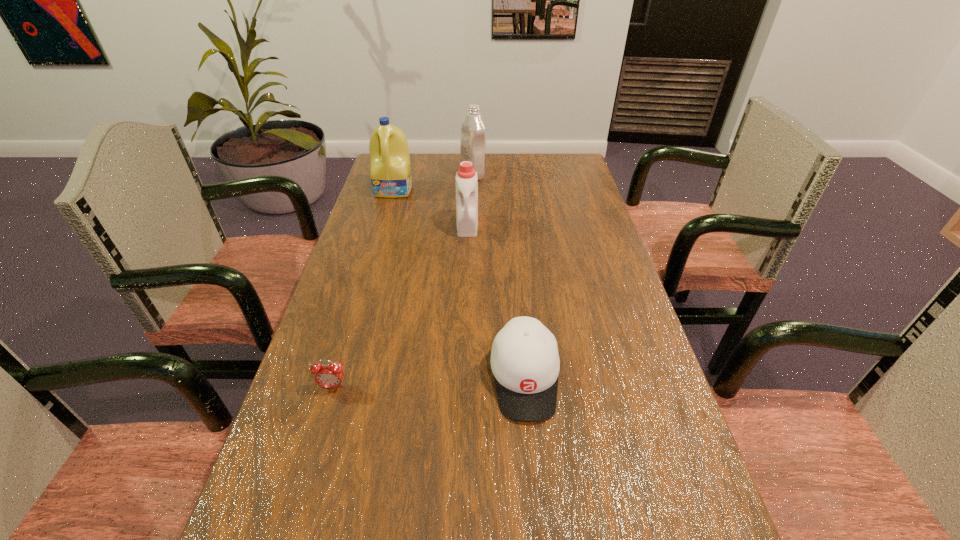
Where is `free space between the leftmost detergent and the third farthest object`? The width and height of the screenshot is (960, 540). free space between the leftmost detergent and the third farthest object is located at coordinates 431,207.

Where is `vacant area that lies between the second shortest object and the leftmost detergent`? vacant area that lies between the second shortest object and the leftmost detergent is located at coordinates pos(460,284).

Identify which object is the second closest to the baseball cap. Please provide its 2D coordinates. Your answer should be formatted as a tuple, i.e. [(x, y)], where the tuple contains the x and y coordinates of a point satisfying the conditions above.

[(466, 183)]

Where is `object that can be found as the closest to the alarm clock`? The width and height of the screenshot is (960, 540). object that can be found as the closest to the alarm clock is located at coordinates (525, 362).

The image size is (960, 540). Find the location of `detergent that is the nearest to the leftmost detergent`. detergent that is the nearest to the leftmost detergent is located at coordinates (473, 131).

Where is `the second closest detergent to the leftmost detergent`? the second closest detergent to the leftmost detergent is located at coordinates (466, 183).